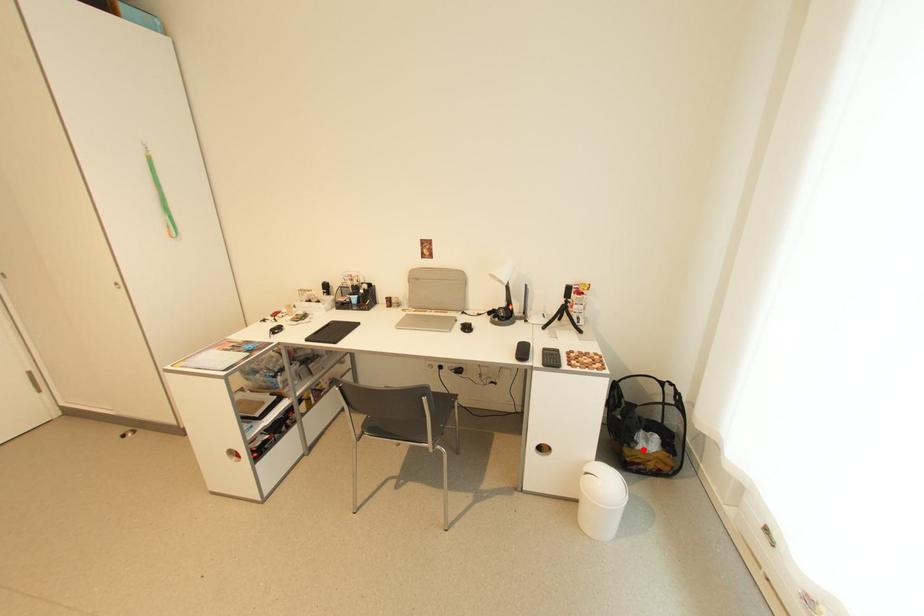
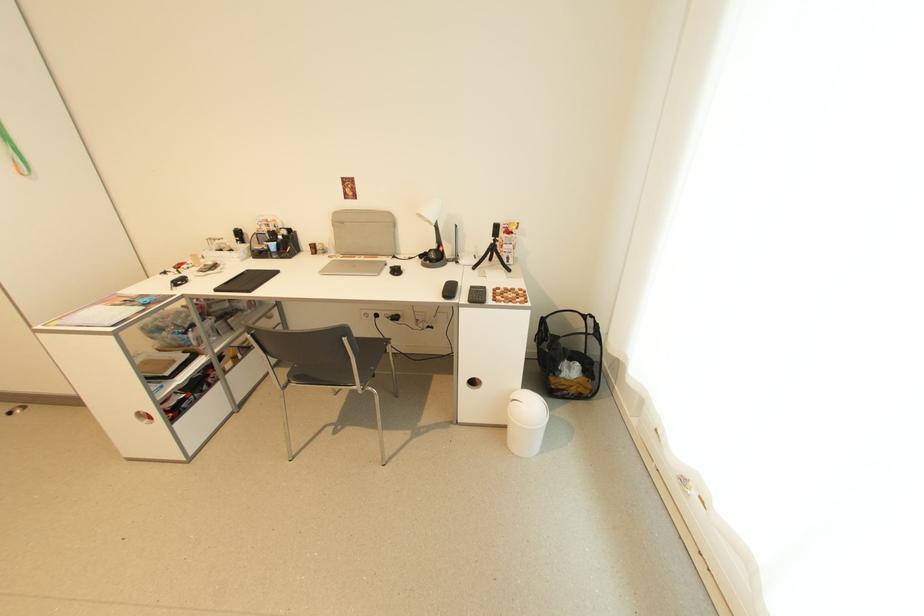
In the second image, find the point that corresponds to the highlighted location in the first image.

(566, 377)